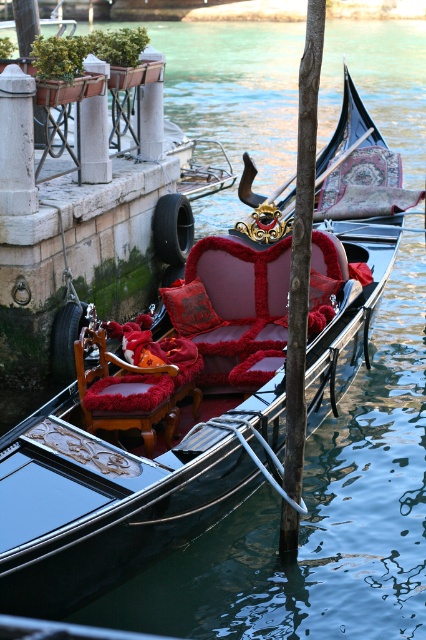
You are standing on the stone pier where the gondola is docked. You notice two points marked on the pier at coordinates point (x=270, y=358) and point (x=169, y=300). Which point is closer to you?

Point (x=270, y=358) is closer to the viewer than point (x=169, y=300).

You are a tourist sitting in the velvet red chair at center of the gondola. You want to place your camera on the silky red cushion at center. Is the cushion above or below the chair?

The velvet red chair at center is positioned under the silky red cushion at center, so the cushion is above the chair.

You are navigating a small boat through the canal and need to dock near the smooth brown wood pole at center. Based on the coordinates provided in the scene description, where should you aim to position your boat?

The smooth brown wood pole at center is located at point (302, 248), so you should aim to position your boat near that coordinate to dock near it.